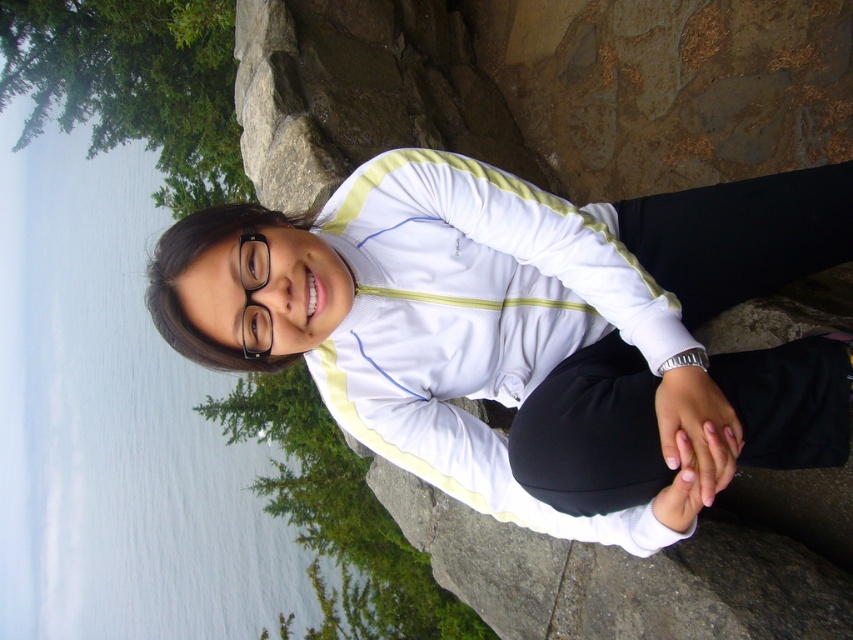
You are a photographer trying to capture the person in the scene. Since you want to ensure both the white smooth jacket at center and the transparent plastic glasses at center are clearly visible in your photo, which object should you focus on first to ensure proper focus, considering their sizes?

The white smooth jacket at center is larger in size than transparent plastic glasses at center. Therefore, you should focus on the white smooth jacket at center first, as it is larger and will be easier to capture clearly, ensuring the smaller transparent plastic glasses at center also come into focus.

You are a fashion designer observing the person in the image. You need to create a new accessory that complements both the white smooth jacket at center and the silver metallic bracelet at lower center. Considering their sizes, which object should the accessory be designed to match in terms of scale?

The white smooth jacket at center has a larger width than the silver metallic bracelet at lower center. Therefore, the accessory should be designed to match the scale of the white smooth jacket at center to ensure it complements both items appropriately.

You are a photographer taking a picture of the person in the scene. You notice the white smooth jacket at center and the silver metallic bracelet at lower center. Which object should you focus on first to ensure both are in sharp focus?

You should focus on the white smooth jacket at center first because it is in front of the silver metallic bracelet at lower center, so focusing on the closer object will help both be in focus.